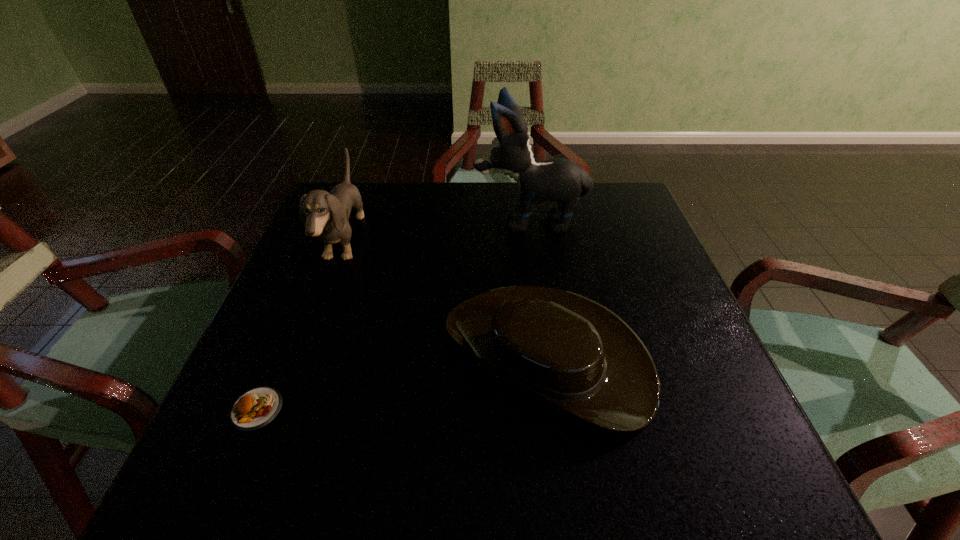
The height and width of the screenshot is (540, 960). In order to click on vacant space that is in between the left puppy and the patty (food) in this screenshot , I will do 300,325.

At what (x,y) coordinates should I click in order to perform the action: click on vacant space that is in between the shortest object and the left puppy. Please return your answer as a coordinate pair (x, y). Looking at the image, I should click on (300, 325).

Identify which object is the third closest to the tallest object. Please provide its 2D coordinates. Your answer should be formatted as a tuple, i.e. [(x, y)], where the tuple contains the x and y coordinates of a point satisfying the conditions above.

[(254, 409)]

Identify the location of object that can be found as the second closest to the taller puppy. This screenshot has width=960, height=540. (325, 215).

Where is `blank space that satisfies the following two spatial constraints: 1. on the back side of the third tallest object; 2. on the right side of the shortest object`? This screenshot has height=540, width=960. blank space that satisfies the following two spatial constraints: 1. on the back side of the third tallest object; 2. on the right side of the shortest object is located at coordinates (279, 355).

Find the location of a particular element. vacant space that satisfies the following two spatial constraints: 1. at the face of the third tallest object; 2. on the right side of the third shortest object is located at coordinates (301, 355).

In order to click on free space that satisfies the following two spatial constraints: 1. on the front-facing side of the right puppy; 2. on the front side of the second shortest object in this screenshot , I will do `click(549, 355)`.